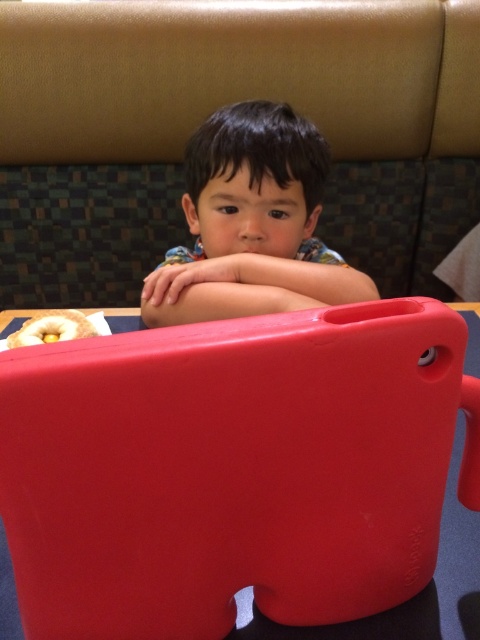
Can you confirm if matte black child at center is smaller than glazed doughnut at lower left?

Incorrect, matte black child at center is not smaller in size than glazed doughnut at lower left.

Is matte black child at center wider than glazed doughnut at lower left?

Correct, the width of matte black child at center exceeds that of glazed doughnut at lower left.

Between point (215, 205) and point (41, 339), which one is positioned behind?

The point (215, 205) is behind.

You are a GUI agent. You are given a task and a screenshot of the screen. Output one action in this format:
    pyautogui.click(x=<x>, y=<y>)
    Task: Click on the matte black child at center
    
    Given the screenshot: What is the action you would take?
    pyautogui.click(x=252, y=224)